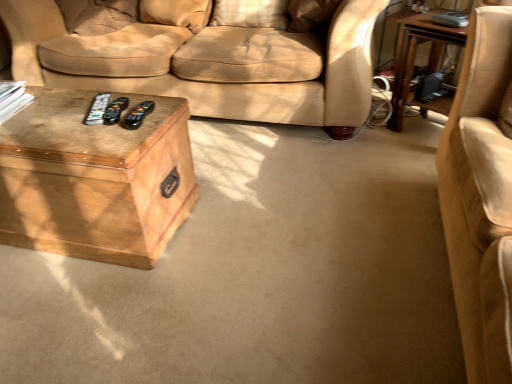
Find the location of a particular element. The height and width of the screenshot is (384, 512). free space in front of black plastic remote at center, marked as the 3th remote in a right-to-left arrangement is located at coordinates (94, 129).